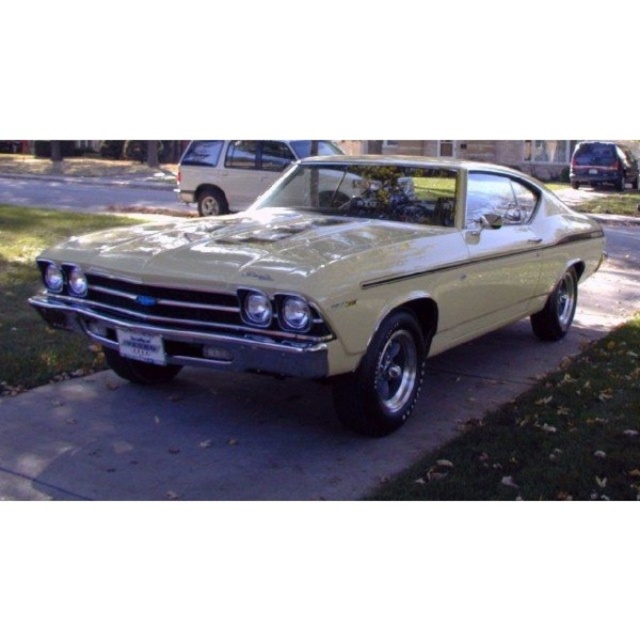
Question: Is metallic gold car at center thinner than matte black minivan at center?

Choices:
 (A) yes
 (B) no

Answer: (A)

Question: Is metallic gold car at center smaller than matte black minivan at center?

Choices:
 (A) no
 (B) yes

Answer: (B)

Question: Is matte gold car at center smaller than white plastic license plate at center?

Choices:
 (A) yes
 (B) no

Answer: (B)

Question: Which point is closer to the camera?

Choices:
 (A) (589, 186)
 (B) (150, 332)

Answer: (B)

Question: Which point appears closest to the camera in this image?

Choices:
 (A) (602, 152)
 (B) (140, 300)

Answer: (B)

Question: Which point appears closest to the camera in this image?

Choices:
 (A) (116, 342)
 (B) (612, 176)
 (C) (188, 170)

Answer: (A)